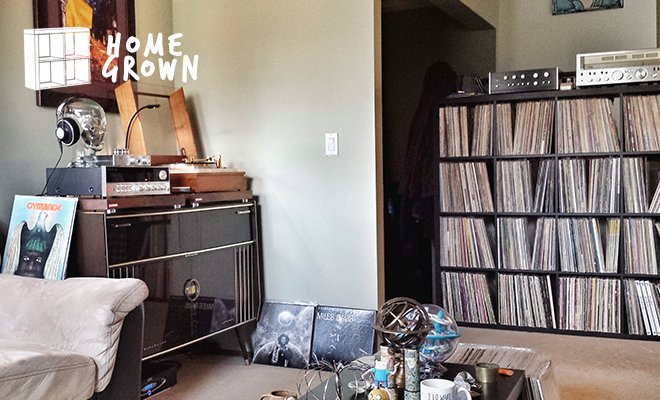
Locate an element on the screen. The width and height of the screenshot is (660, 400). cabinet is located at coordinates (216, 289).